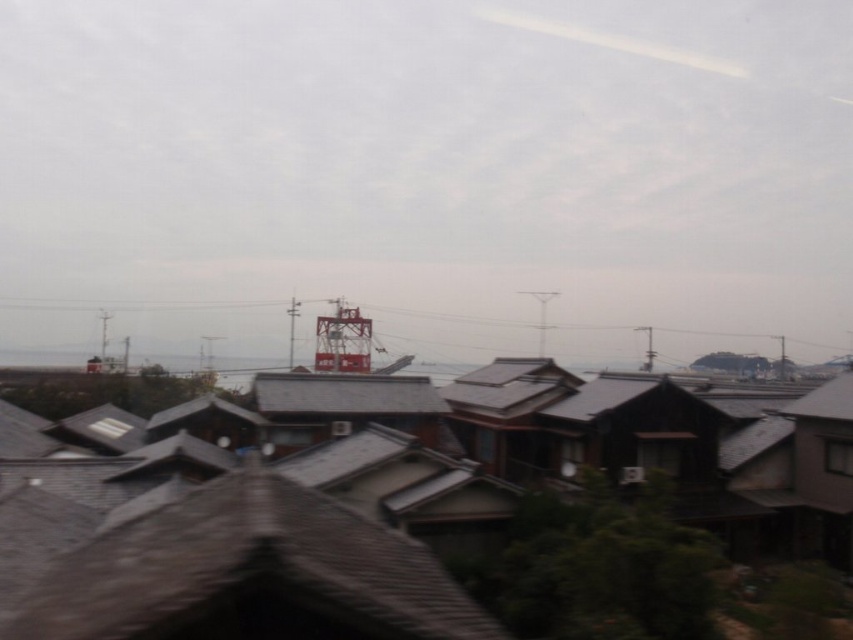
Question: Can you confirm if gray tile roof at center is positioned to the left of metallic red tower at center?

Choices:
 (A) no
 (B) yes

Answer: (A)

Question: Does gray tile roof at center lie in front of metallic red tower at center?

Choices:
 (A) no
 (B) yes

Answer: (B)

Question: Which point is closer to the camera?

Choices:
 (A) (453, 317)
 (B) (503, 513)

Answer: (B)

Question: Is gray tile roof at center bigger than metallic red tower at center?

Choices:
 (A) yes
 (B) no

Answer: (B)

Question: Which object is farther from the camera taking this photo?

Choices:
 (A) metallic red tower at center
 (B) gray tile roof at center

Answer: (A)